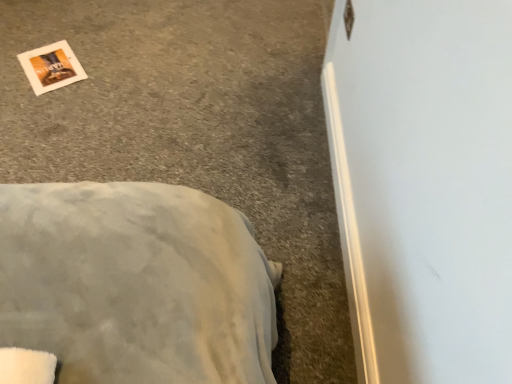
The width and height of the screenshot is (512, 384). What are the coordinates of `vacant point above gray carpet at lower left (from a real-world perspective)` in the screenshot? It's located at (147, 124).